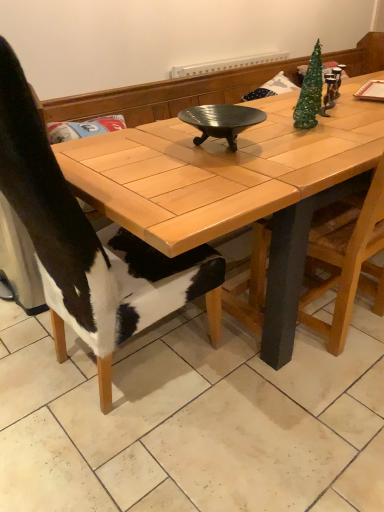
Identify the location of vacant location below black ribbed metal wok at center (from a real-world perspective). (225, 152).